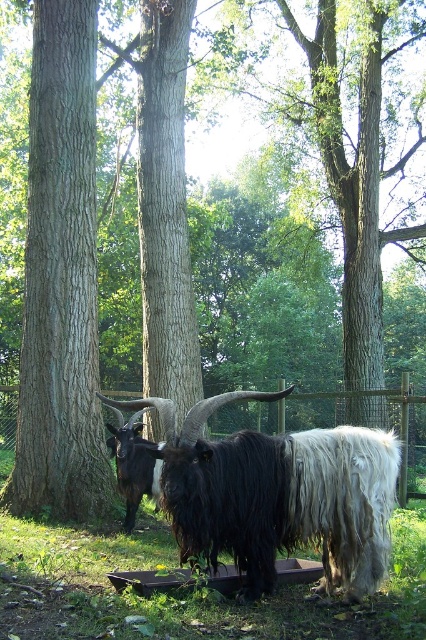
You are a hiker who wants to approach the black woolly goat at center and the dark brown fur goat at left. Which goat should you approach first if you want to reach the one closer to your current position?

The dark brown fur goat at left is closer to you since it is positioned to the left of the black woolly goat at center, which is further to the right.